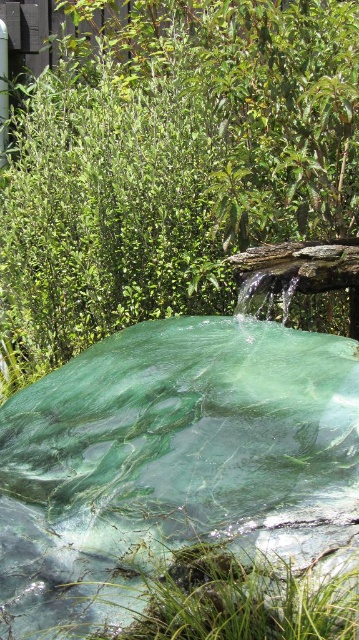
Between green leafy bush at upper center and green leafy grass at lower center, which one has more height?

green leafy bush at upper center is taller.

Who is more forward, (6,216) or (333,579)?

Positioned in front is point (333,579).

The width and height of the screenshot is (359, 640). Find the location of `green leafy bush at upper center`. green leafy bush at upper center is located at coordinates (171, 163).

Which is more to the left, green leafy bush at upper center or green marble water at center?

green leafy bush at upper center is more to the left.

Between green leafy bush at upper center and green marble water at center, which one has more height?

green leafy bush at upper center is taller.

Is point (234, 6) more distant than point (100, 435)?

Yes.

Locate an element on the screen. green leafy bush at upper center is located at coordinates (171, 163).

Does point (40, 492) come closer to viewer compared to point (277, 634)?

No.

Based on the photo, does green marble water at center have a greater width compared to green leafy grass at lower center?

Correct, the width of green marble water at center exceeds that of green leafy grass at lower center.

The height and width of the screenshot is (640, 359). Describe the element at coordinates (171, 461) in the screenshot. I see `green marble water at center` at that location.

The height and width of the screenshot is (640, 359). Identify the location of green marble water at center. (171, 461).